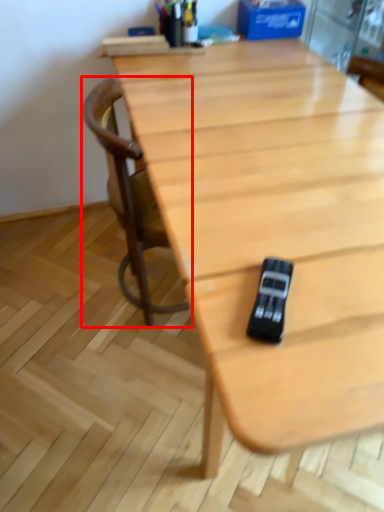
Question: Observing the image, what is the correct spatial positioning of chair (annotated by the red box) in reference to game controller?

Choices:
 (A) right
 (B) left

Answer: (B)